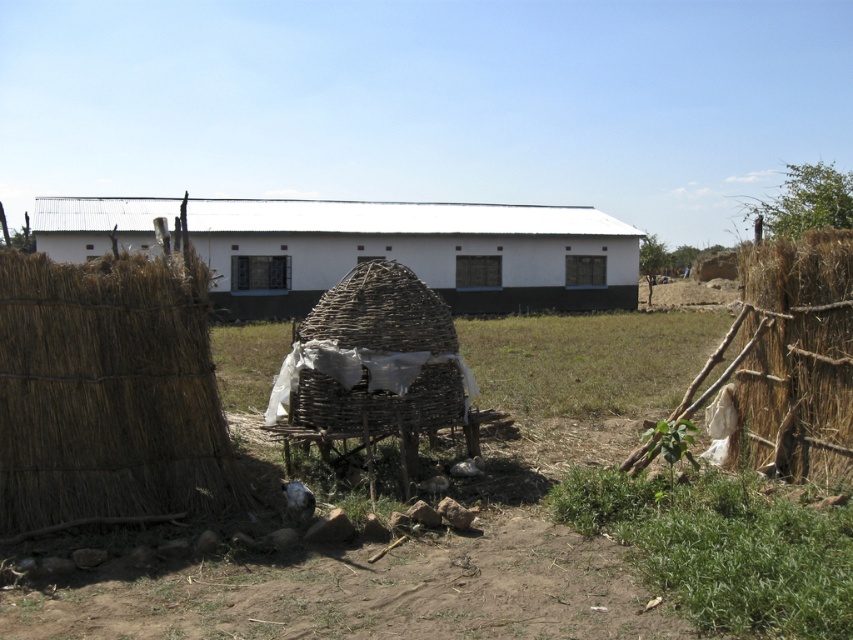
Which is in front, point (708, 614) or point (766, 339)?

Positioned in front is point (708, 614).

Who is lower down, brown dirt field at center or brown straw hay at right?

brown dirt field at center is below.

Which is in front, point (172, 636) or point (788, 348)?

Point (172, 636) is in front.

Find the location of `brown dirt field at center`. brown dirt field at center is located at coordinates tap(440, 525).

Is brown dirt field at center taller than brown woven hay at left?

In fact, brown dirt field at center may be shorter than brown woven hay at left.

Which is behind, point (289, 556) or point (70, 426)?

Point (70, 426)

The image size is (853, 640). I want to click on brown dirt field at center, so click(440, 525).

Find the location of a particular element. This screenshot has width=853, height=640. brown dirt field at center is located at coordinates (440, 525).

In the scene shown: Is brown woven hay at left behind white corrugated metal building at center?

No.

Who is more distant from viewer, (160, 397) or (479, 256)?

Positioned behind is point (479, 256).

Between point (94, 499) and point (280, 205), which one is positioned behind?

The point (280, 205) is more distant.

Where is `brown woven hay at left`? This screenshot has width=853, height=640. brown woven hay at left is located at coordinates (108, 394).